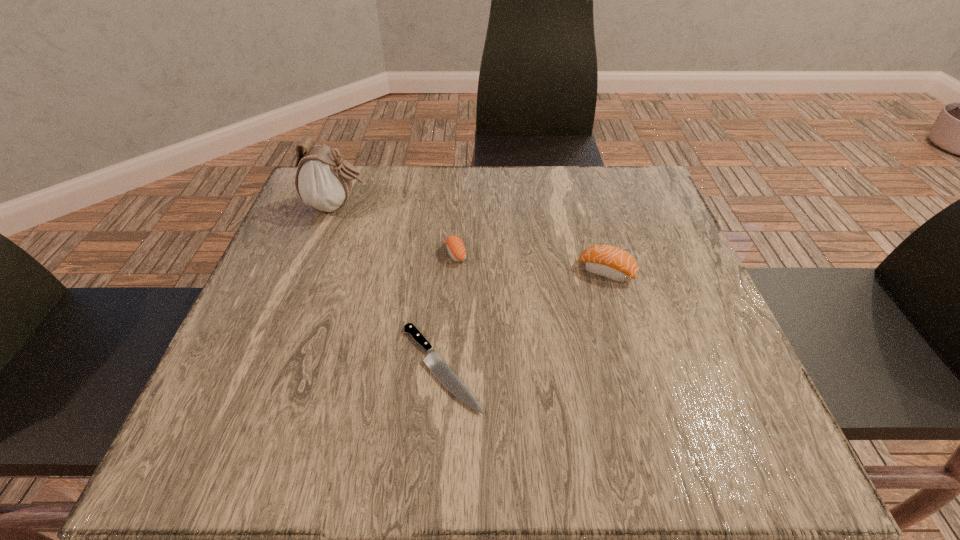
Image resolution: width=960 pixels, height=540 pixels. What are the coordinates of `blank space at the right edge of the desktop` in the screenshot? It's located at (655, 231).

In the image, there is a desktop. Identify the location of vacant space at the near left corner. (210, 422).

Locate an element on the screen. This screenshot has height=540, width=960. free location at the far right corner is located at coordinates (638, 175).

Identify the location of vacant area at the near right corner. (688, 441).

The image size is (960, 540). What are the coordinates of `vacant space that is in between the nearest object and the leftmost object` in the screenshot? It's located at (390, 287).

This screenshot has width=960, height=540. Find the location of `free point between the leftmost object and the steak knife`. free point between the leftmost object and the steak knife is located at coordinates (390, 287).

Image resolution: width=960 pixels, height=540 pixels. What are the coordinates of `vacant space in between the taller sushi and the third tallest object` in the screenshot? It's located at (531, 262).

Identify the location of vacant space that is in between the left sushi and the pouch. (397, 230).

Where is `free space between the shortest object and the third shortest object`? The image size is (960, 540). free space between the shortest object and the third shortest object is located at coordinates (524, 320).

Identify the location of vacant area between the steak knife and the second shortest object. (449, 310).